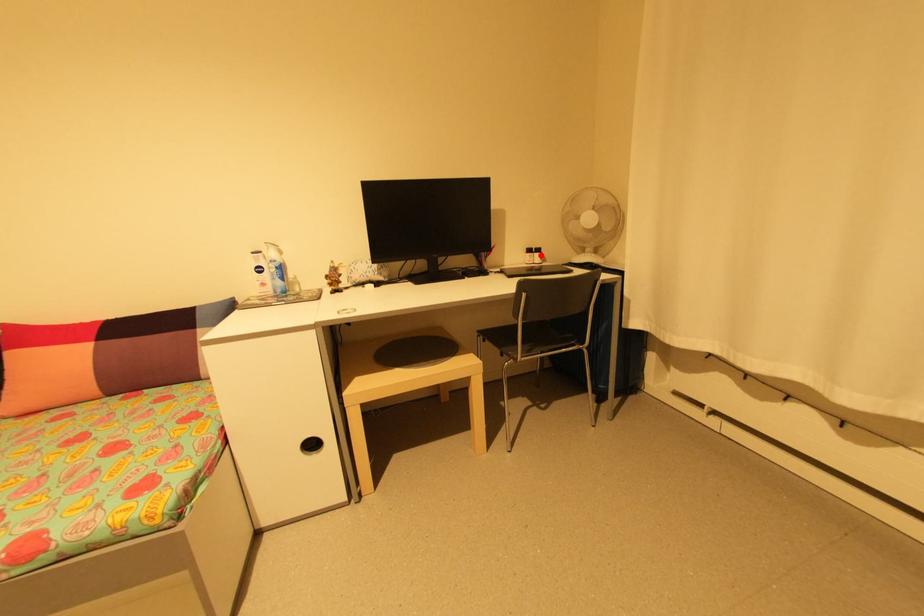
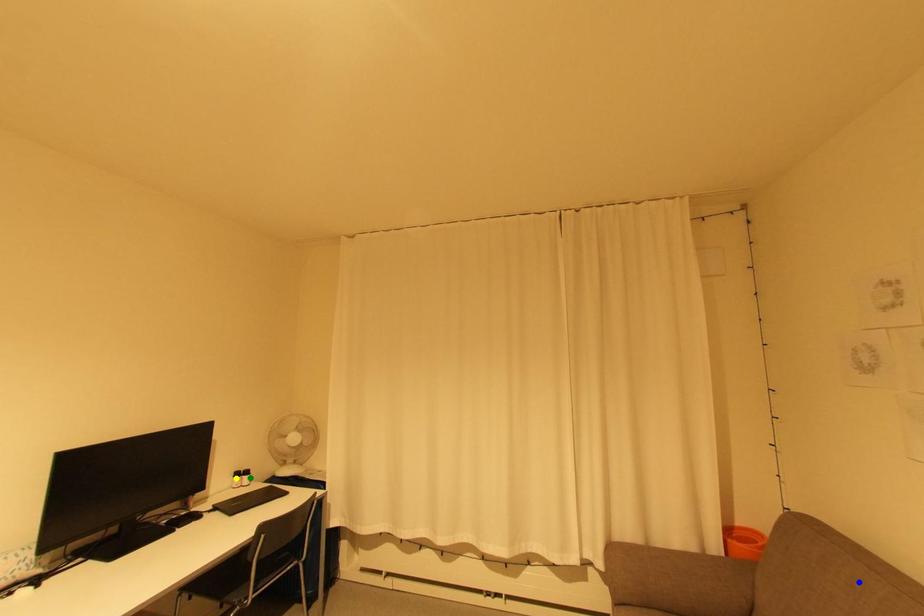
Question: I am providing you with two images of the same scene from different viewpoints. A red point is marked on the first image. You are given multiple points on the second image. Which point in image 2 represents the same 3d spot as the red point in image 1?

Choices:
 (A) yellow point
 (B) green point
 (C) blue point

Answer: (B)